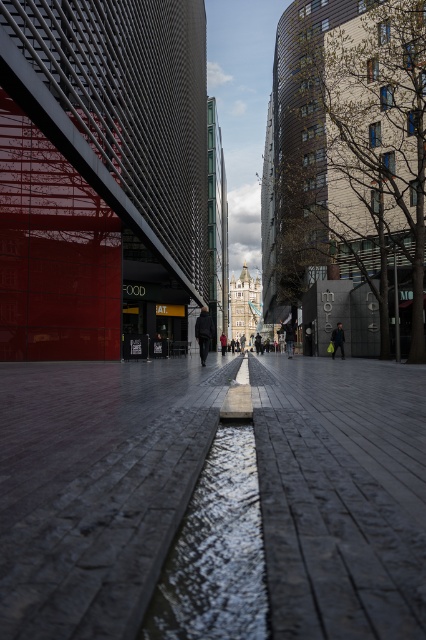
Is point (132, 413) positioned in front of point (226, 346)?

That is True.

Between dark gray stone pavement at center and red jacket at center, which one is positioned higher?

dark gray stone pavement at center is above.

Find the location of a particular element. dark gray stone pavement at center is located at coordinates (94, 488).

Looking at this image, who is shorter, dark gray jacket at center or red jacket at center?

With less height is red jacket at center.

The height and width of the screenshot is (640, 426). Identify the location of dark gray jacket at center. (204, 332).

In order to click on dark gray jacket at center in this screenshot , I will do `click(204, 332)`.

Does dark gray stone pavement at center appear on the right side of dark gray jacket at center?

In fact, dark gray stone pavement at center is to the left of dark gray jacket at center.

Can you confirm if dark gray stone pavement at center is bigger than dark gray jacket at center?

Yes.

Image resolution: width=426 pixels, height=640 pixels. I want to click on dark gray stone pavement at center, so click(94, 488).